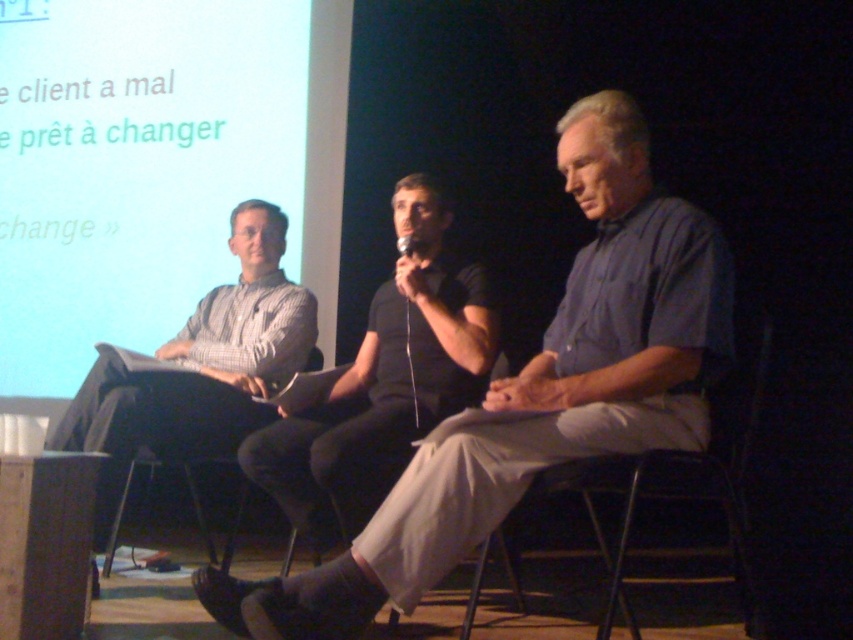
Is striped cotton shirt at left smaller than metallic gray chair at center?

Incorrect, striped cotton shirt at left is not smaller in size than metallic gray chair at center.

Is point (94, 541) positioned before point (131, 467)?

Yes, point (94, 541) is in front of point (131, 467).

Where is `striped cotton shirt at left`? This screenshot has width=853, height=640. striped cotton shirt at left is located at coordinates (198, 369).

How far apart are striped cotton shirt at left and metallic silver chair at center?

striped cotton shirt at left and metallic silver chair at center are 1.28 meters apart from each other.

Identify the location of striped cotton shirt at left. The height and width of the screenshot is (640, 853). coord(198,369).

Describe the element at coordinates (198, 369) in the screenshot. This screenshot has width=853, height=640. I see `striped cotton shirt at left` at that location.

Where is `striped cotton shirt at left`? The height and width of the screenshot is (640, 853). striped cotton shirt at left is located at coordinates (198, 369).

Who is more forward, (677, 481) or (508, 564)?

Point (677, 481) is in front.

Which is behind, point (469, 611) or point (524, 604)?

The point (524, 604) is behind.

Which is in front, point (753, 342) or point (521, 595)?

Point (753, 342) is more forward.

This screenshot has width=853, height=640. What are the coordinates of `metallic silver chair at center` in the screenshot? It's located at (654, 486).